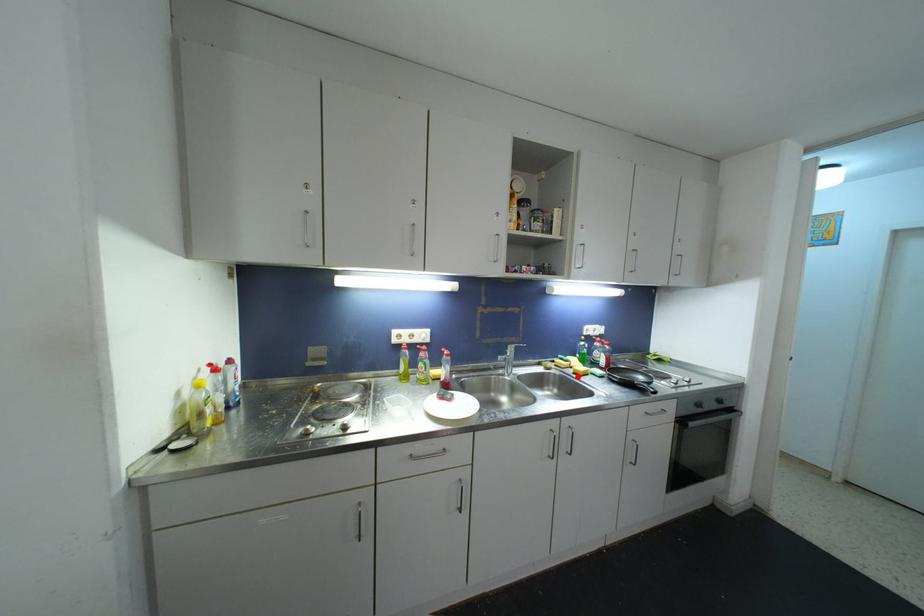
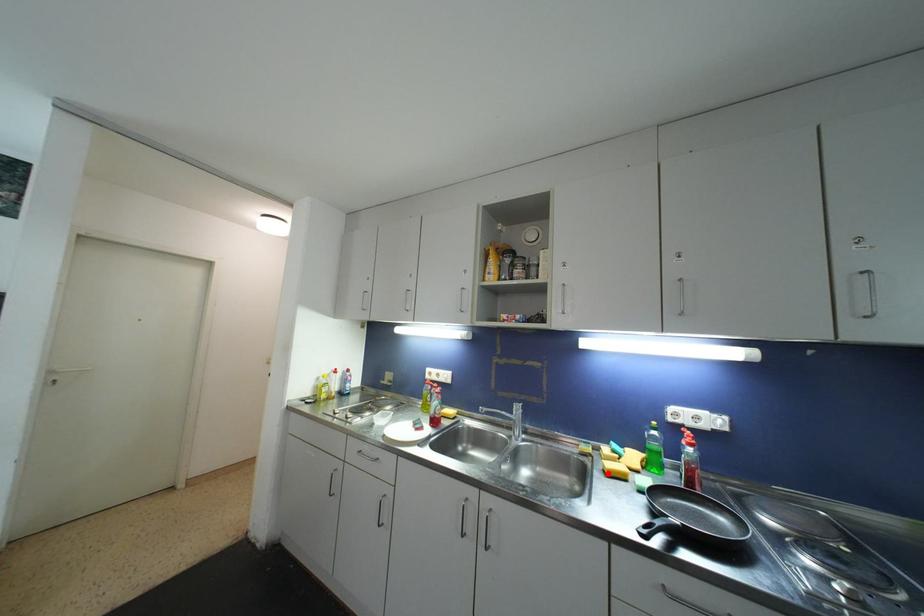
I am providing you with two images of the same scene from different viewpoints. A red point is marked on the first image and another point is marked on the second image. Is the marked point in image1 the same physical position as the marked point in image2?

Yes